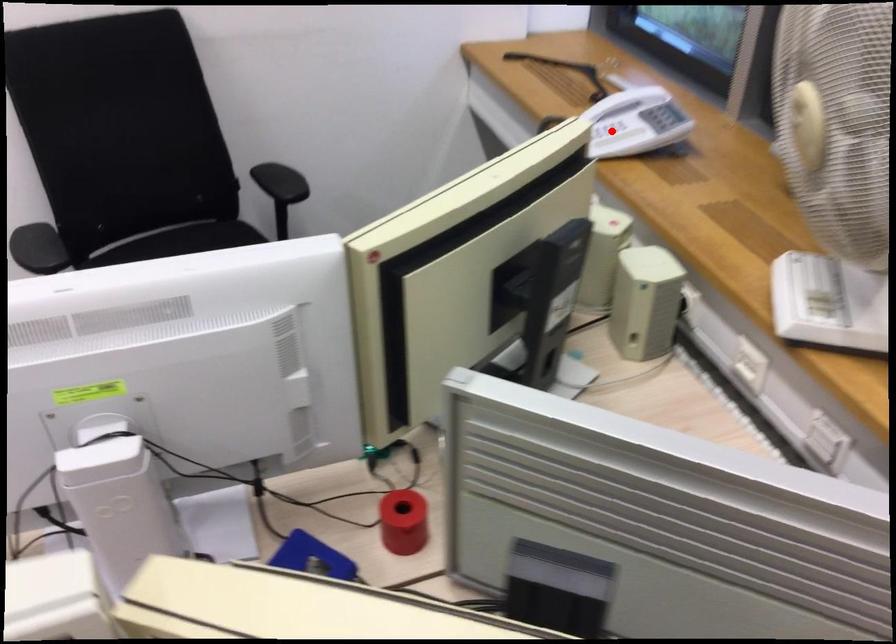
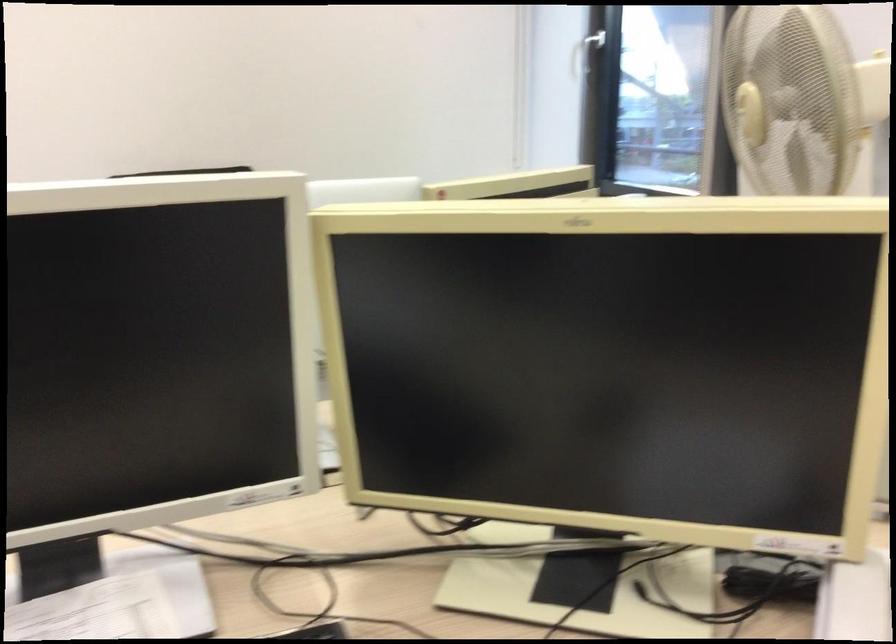
Question: I am providing you with two images of the same scene from different viewpoints. A red point is marked on the first image. Can you still see the location of the red point in image 2?

Choices:
 (A) Yes
 (B) No

Answer: (B)